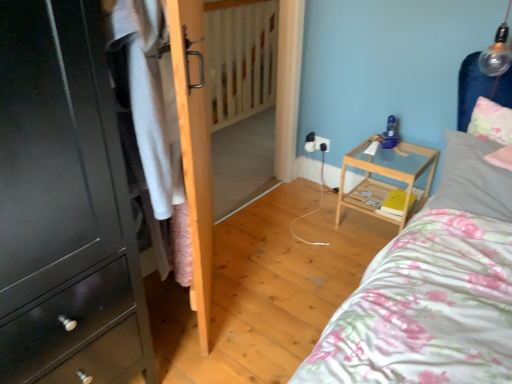
Question: In the image, is gray fabric pillow at upper right, placed as the 1th pillow when sorted from bottom to top, positioned in front of or behind white plastic electric outlet at center?

Choices:
 (A) behind
 (B) front

Answer: (B)

Question: Considering the positions of gray fabric pillow at upper right, arranged as the second pillow when viewed from the top, and white plastic electric outlet at center in the image, is gray fabric pillow at upper right, arranged as the second pillow when viewed from the top, wider or thinner than white plastic electric outlet at center?

Choices:
 (A) thin
 (B) wide

Answer: (B)

Question: Considering the real-world distances, which object is closest to the white plastic electric outlet at center?

Choices:
 (A) white cotton shirt at left
 (B) matte black cabinet at left
 (C) wooden door at left
 (D) wooden radiator at center
 (E) light wood/transparent glass nightstand at center-right

Answer: (E)

Question: Which of these objects is positioned farthest from the wooden door at left?

Choices:
 (A) white plastic electric outlet at center
 (B) matte black cabinet at left
 (C) wooden radiator at center
 (D) light wood/transparent glass nightstand at center-right
 (E) white cotton shirt at left

Answer: (C)